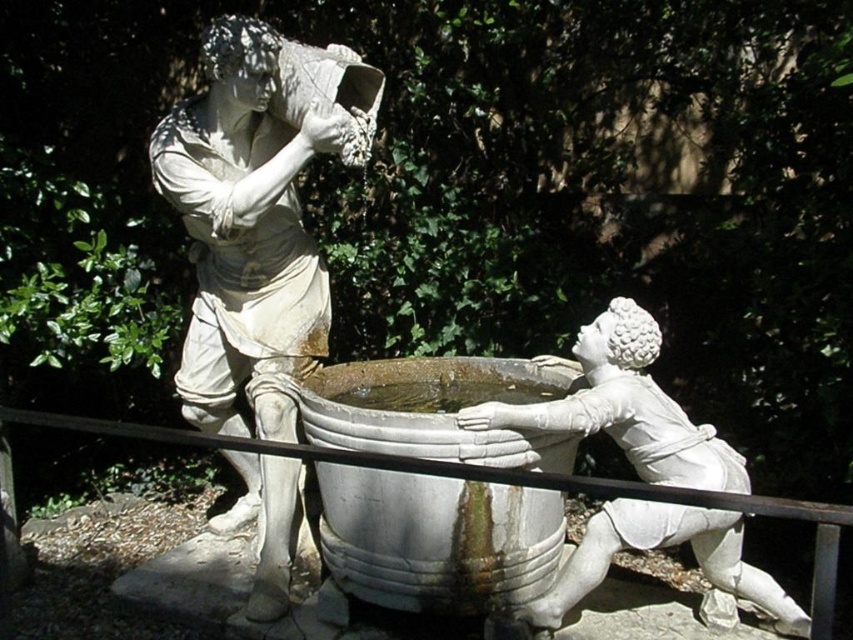
Describe the element at coordinates (252, 225) in the screenshot. I see `white stone statue at left` at that location.

Does white stone statue at left have a greater height compared to white marble boy at lower right?

Yes.

At what (x,y) coordinates should I click in order to perform the action: click on white stone statue at left. Please return your answer as a coordinate pair (x, y). Looking at the image, I should click on (252, 225).

Between white marble boy at lower right and metal rail at lower center, which one has more height?

Standing taller between the two is white marble boy at lower right.

Does white marble boy at lower right have a greater height compared to metal rail at lower center?

Yes.

At what (x,y) coordinates should I click in order to perform the action: click on white marble boy at lower right. Please return your answer as a coordinate pair (x, y). The width and height of the screenshot is (853, 640). Looking at the image, I should click on (624, 406).

Which is more to the left, white stone basin at center or white marble boy at lower right?

Positioned to the left is white stone basin at center.

Is point (553, 461) positioned behind point (709, 509)?

That is True.

I want to click on white stone basin at center, so click(436, 540).